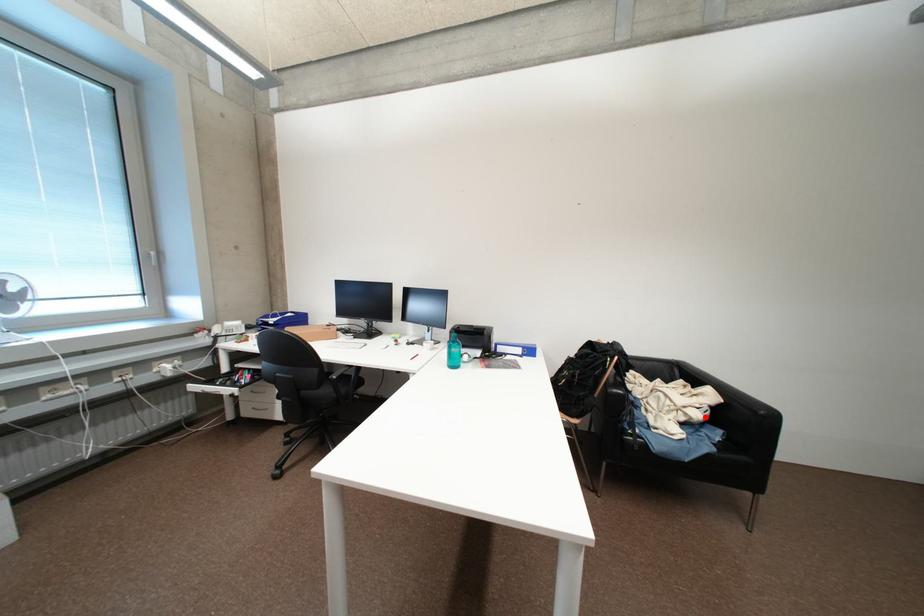
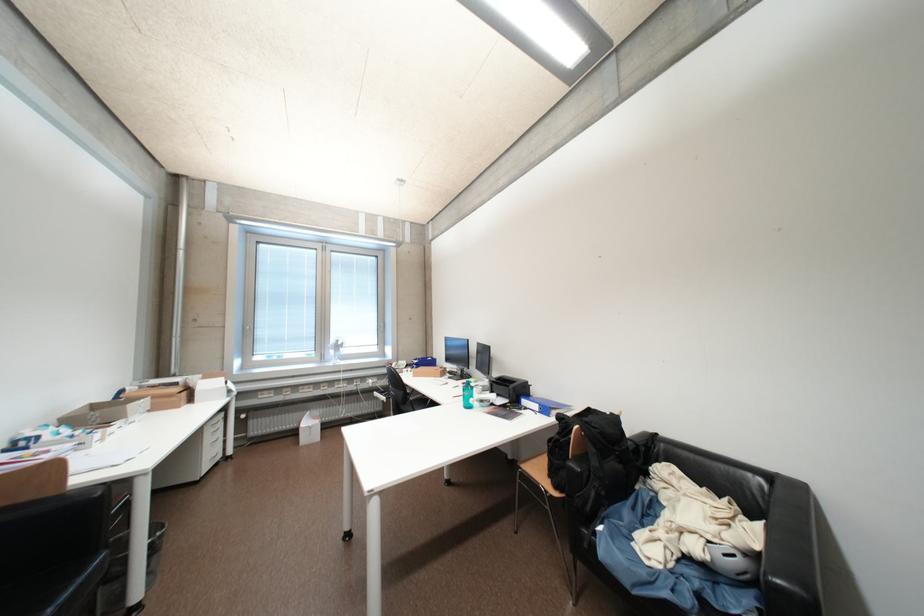
The point at the highlighted location is marked in the first image. Where is the corresponding point in the second image?

(704, 551)